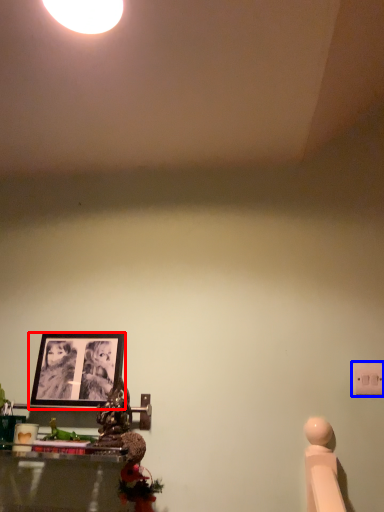
Question: Which of the following is the closest to the observer, picture frame (highlighted by a red box) or light switch (highlighted by a blue box)?

Choices:
 (A) picture frame
 (B) light switch

Answer: (B)